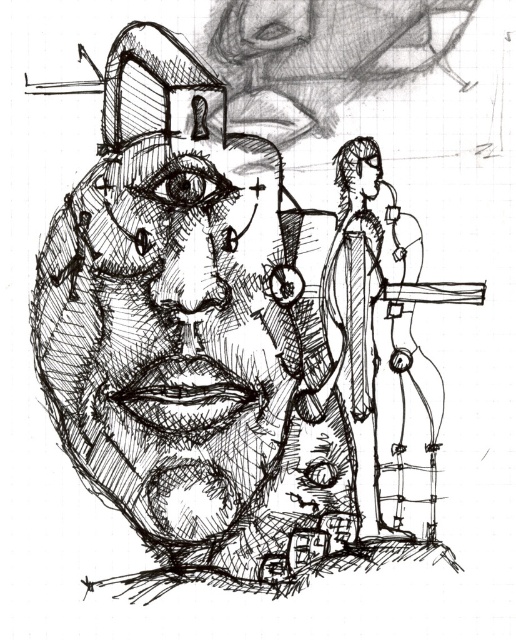
You are an artist analyzing the spatial relationships in the sketch. You have two points marked as point 1 at coordinates [154,426] and point 2 at coordinates [361,141]. Based on the sketch, which point is closer to the viewer?

Point 1 at coordinates [154,426] is closer to the viewer than point 2 at coordinates [361,141].

Based on the provided scene description, where is the black ink drawing of face at center located in relation to the point marked at coordinates [162,344]?

The point marked at coordinates [162,344] marks the location of the black ink drawing of face at center.

Based on the coordinates provided, where is the black ink drawing of face at center located in the image?

The black ink drawing of face at center is located at the coordinates point (162, 344).